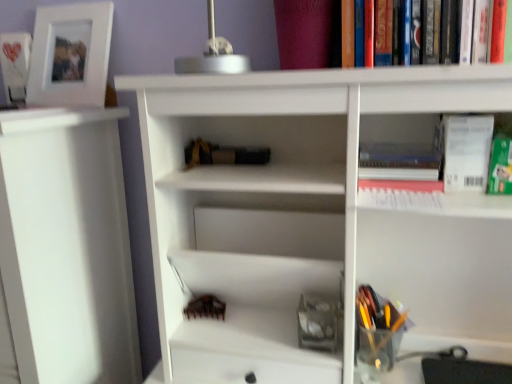
What do you see at coordinates (379, 323) in the screenshot?
I see `translucent plastic pen holder at lower right` at bounding box center [379, 323].

Locate an element on the screen. The width and height of the screenshot is (512, 384). white matte photo frame at upper left, placed as the third book when sorted from right to left is located at coordinates (15, 64).

You are a GUI agent. You are given a task and a screenshot of the screen. Output one action in this format:
    pyautogui.click(x=<x>, y=<y>)
    Task: Click on the white paper at upper right
    
    Given the screenshot: What is the action you would take?
    pyautogui.click(x=466, y=152)

Where is `white matte picture frame at upper left`? white matte picture frame at upper left is located at coordinates (70, 55).

Find the location of a particular element. This screenshot has width=512, height=384. black matte book at center, the second book from the bottom is located at coordinates (223, 155).

Is point (387, 175) closer to camera compared to point (206, 162)?

Yes, point (387, 175) is closer to viewer.

Can you confirm if hardcover book at upper right, the 3th book viewed from the back, is shorter than black matte book at center, the second book from the bottom?

In fact, hardcover book at upper right, the 3th book viewed from the back, may be taller than black matte book at center, the second book from the bottom.

How much distance is there between hardcover book at upper right, which is the third book from left to right, and black matte book at center, which appears as the 2th book when viewed from the back?

hardcover book at upper right, which is the third book from left to right, is 11.19 inches from black matte book at center, which appears as the 2th book when viewed from the back.

Which object is thinner, hardcover book at upper right, acting as the first book starting from the front, or black matte book at center, the 2th book positioned from the front?

With smaller width is black matte book at center, the 2th book positioned from the front.

In the scene shown: From a real-world perspective, is white paper at upper right positioned above or below hardcover book at upper right, acting as the first book starting from the front?

Clearly, from a real-world perspective, white paper at upper right is above hardcover book at upper right, acting as the first book starting from the front.

In the scene shown: Is white paper at upper right inside the boundaries of hardcover book at upper right, which ranks as the 1th book in right-to-left order, or outside?

white paper at upper right is not inside hardcover book at upper right, which ranks as the 1th book in right-to-left order, it's outside.

Which of these two, white paper at upper right or hardcover book at upper right, which ranks as the 1th book in right-to-left order, stands shorter?

With less height is hardcover book at upper right, which ranks as the 1th book in right-to-left order.

Which is closer to the camera, (370, 300) or (405, 166)?

Clearly, point (370, 300) is more distant from the camera than point (405, 166).

Is translucent plastic pen holder at lower right spatially inside hardcover book at upper right, marked as the third book in a top-to-bottom arrangement, or outside of it?

translucent plastic pen holder at lower right is spatially situated outside hardcover book at upper right, marked as the third book in a top-to-bottom arrangement.

Which of these two, translucent plastic pen holder at lower right or hardcover book at upper right, which is the first book from bottom to top, is thinner?

Thinner between the two is hardcover book at upper right, which is the first book from bottom to top.

Which of these two, translucent plastic pen holder at lower right or hardcover book at upper right, which ranks as the 1th book in right-to-left order, stands shorter?

hardcover book at upper right, which ranks as the 1th book in right-to-left order, is shorter.

I want to click on book that is above the white paper at upper right (from a real-world perspective), so click(15, 64).

Can you confirm if white matte photo frame at upper left, arranged as the 1th book when viewed from the left, is positioned to the right of white paper at upper right?

Incorrect, white matte photo frame at upper left, arranged as the 1th book when viewed from the left, is not on the right side of white paper at upper right.

From the image's perspective, which one is positioned lower, white matte photo frame at upper left, arranged as the 3th book when viewed from the front, or white paper at upper right?

white paper at upper right appears lower in the image.

Is white matte photo frame at upper left, the first book when ordered from back to front, inside or outside of white paper at upper right?

white matte photo frame at upper left, the first book when ordered from back to front, is spatially situated outside white paper at upper right.

Can you confirm if translucent plastic pen holder at lower right is shorter than white matte picture frame at upper left?

Yes, translucent plastic pen holder at lower right is shorter than white matte picture frame at upper left.

Considering the positions of objects translucent plastic pen holder at lower right and white matte picture frame at upper left in the image provided, who is in front, translucent plastic pen holder at lower right or white matte picture frame at upper left?

Positioned in front is translucent plastic pen holder at lower right.

Is translucent plastic pen holder at lower right turned away from white matte picture frame at upper left?

No, translucent plastic pen holder at lower right's orientation is not away from white matte picture frame at upper left.

Considering the sizes of white matte shelf at left and white paper at upper right in the image, is white matte shelf at left bigger or smaller than white paper at upper right?

white matte shelf at left is bigger than white paper at upper right.

Is white matte shelf at left in front of or behind white paper at upper right in the image?

Clearly, white matte shelf at left is in front of white paper at upper right.

Is white matte shelf at left to the left of white paper at upper right from the viewer's perspective?

Yes.

In terms of height, does white matte shelf at left look taller or shorter compared to white paper at upper right?

In the image, white matte shelf at left appears to be taller than white paper at upper right.

Is the surface of white matte picture frame at upper left in direct contact with white paper at upper right?

white matte picture frame at upper left and white paper at upper right are clearly separated.

Is point (95, 91) closer to camera compared to point (488, 123)?

No, (95, 91) is behind (488, 123).

Considering the relative sizes of white matte picture frame at upper left and white paper at upper right in the image provided, is white matte picture frame at upper left shorter than white paper at upper right?

In fact, white matte picture frame at upper left may be taller than white paper at upper right.

Is white matte picture frame at upper left inside the boundaries of white paper at upper right, or outside?

white matte picture frame at upper left is spatially situated outside white paper at upper right.

Starting from the hardcover book at upper right, the 3th book viewed from the back, which book is the 1st one to the left? Please provide its 2D coordinates.

[(223, 155)]

Where is `paperback book above the hardcover book at upper right, marked as the third book in a top-to-bottom arrangement (from the image's perspective)`? The height and width of the screenshot is (384, 512). paperback book above the hardcover book at upper right, marked as the third book in a top-to-bottom arrangement (from the image's perspective) is located at coordinates (466, 152).

From the image, which object appears to be farther from white paper at upper right, black matte book at center, which appears as the 2th book when viewed from the back, or white matte photo frame at upper left, the first book when ordered from back to front?

white matte photo frame at upper left, the first book when ordered from back to front, is positioned further to the anchor white paper at upper right.

Based on their spatial positions, is white matte photo frame at upper left, the first book when ordered from back to front, or translucent plastic pen holder at lower right closer to black matte book at center, which is the second book from top to bottom?

translucent plastic pen holder at lower right is closer to black matte book at center, which is the second book from top to bottom.

Considering their positions, is translucent plastic pen holder at lower right positioned closer to white matte shelf at left than white matte photo frame at upper left, positioned as the first book in top-to-bottom order?

Based on the image, white matte photo frame at upper left, positioned as the first book in top-to-bottom order, appears to be nearer to white matte shelf at left.

Which object lies further to the anchor point white matte shelf at left, hardcover book at upper right, which ranks as the 1th book in right-to-left order, or black matte book at center, the second book when ordered from right to left?

hardcover book at upper right, which ranks as the 1th book in right-to-left order, lies further to white matte shelf at left than the other object.

Based on the photo, based on their spatial positions, is white matte picture frame at upper left or black matte book at center, the 2th book positioned from the front, closer to translucent plastic pen holder at lower right?

Based on the image, black matte book at center, the 2th book positioned from the front, appears to be nearer to translucent plastic pen holder at lower right.

Estimate the real-world distances between objects in this image. Which object is closer to white paper at upper right, white matte photo frame at upper left, arranged as the 1th book when viewed from the left, or translucent plastic pen holder at lower right?

The object closer to white paper at upper right is translucent plastic pen holder at lower right.

From the image, which object appears to be farther from white matte shelf at left, translucent plastic pen holder at lower right or hardcover book at upper right, marked as the third book in a top-to-bottom arrangement?

hardcover book at upper right, marked as the third book in a top-to-bottom arrangement, is further to white matte shelf at left.

Estimate the real-world distances between objects in this image. Which object is closer to white matte photo frame at upper left, the first book when ordered from back to front, white paper at upper right or white matte shelf at left?

white matte shelf at left is closer to white matte photo frame at upper left, the first book when ordered from back to front.

Where is `stationery between white matte picture frame at upper left and hardcover book at upper right, which ranks as the 1th book in right-to-left order, in the horizontal direction`? This screenshot has height=384, width=512. stationery between white matte picture frame at upper left and hardcover book at upper right, which ranks as the 1th book in right-to-left order, in the horizontal direction is located at coordinates (379, 323).

Identify the location of book between white matte picture frame at upper left and hardcover book at upper right, which ranks as the 1th book in right-to-left order. (223, 155).

In order to click on book located between white matte photo frame at upper left, arranged as the 3th book when viewed from the front, and translucent plastic pen holder at lower right in the left-right direction in this screenshot , I will do `click(223, 155)`.

Locate an element on the screen. This screenshot has width=512, height=384. stationery situated between white matte photo frame at upper left, arranged as the 3th book when viewed from the front, and white paper at upper right from left to right is located at coordinates (379, 323).